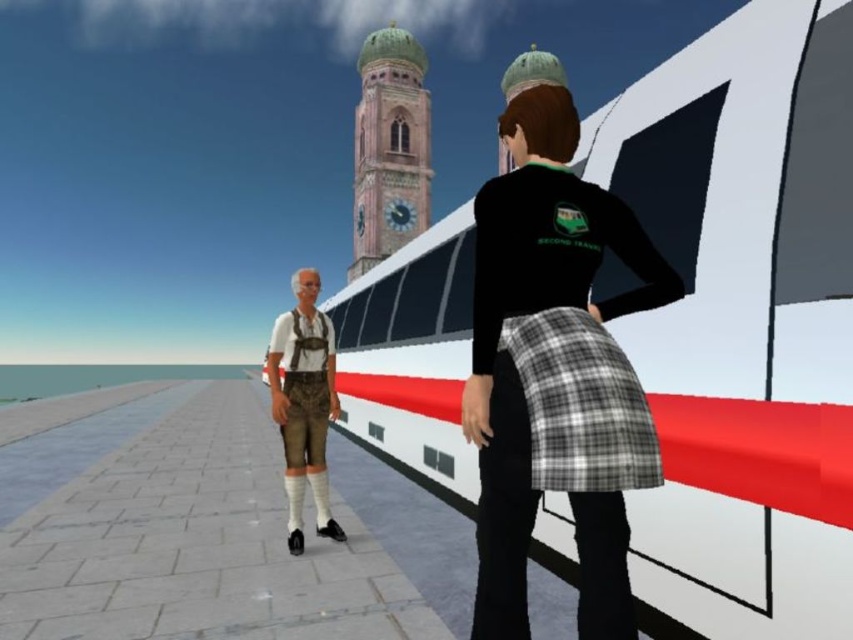
Looking at this image, can you confirm if green stone clock tower at center is positioned to the right of camo fabric kilt at center?

In fact, green stone clock tower at center is to the left of camo fabric kilt at center.

Is green stone clock tower at center smaller than camo fabric kilt at center?

Incorrect, green stone clock tower at center is not smaller in size than camo fabric kilt at center.

The height and width of the screenshot is (640, 853). Describe the element at coordinates (389, 147) in the screenshot. I see `green stone clock tower at center` at that location.

Identify the location of green stone clock tower at center. Image resolution: width=853 pixels, height=640 pixels. (389, 147).

Can you confirm if gray plaid kilt at center is shorter than camo fabric kilt at center?

Indeed, gray plaid kilt at center has a lesser height compared to camo fabric kilt at center.

This screenshot has width=853, height=640. What do you see at coordinates (581, 404) in the screenshot?
I see `gray plaid kilt at center` at bounding box center [581, 404].

I want to click on gray plaid kilt at center, so click(x=581, y=404).

Does gray plaid kilt at center appear on the right side of green stone clock tower at center?

Indeed, gray plaid kilt at center is positioned on the right side of green stone clock tower at center.

Between point (515, 356) and point (370, 131), which one is positioned behind?

The point (370, 131) is more distant.

The width and height of the screenshot is (853, 640). I want to click on gray plaid kilt at center, so click(581, 404).